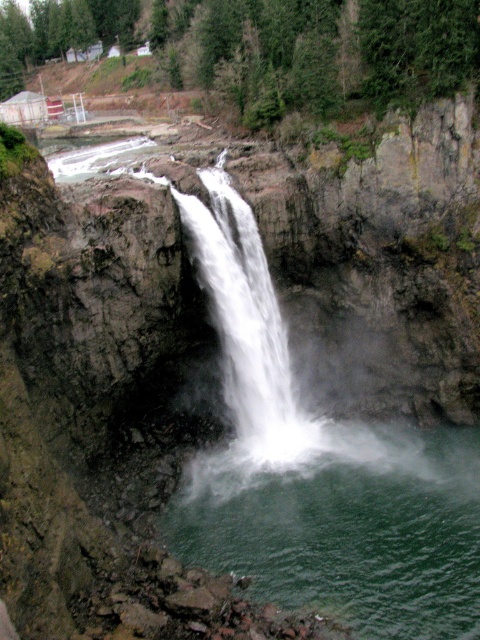
Is point (416, 595) positioned behind point (278, 422)?

That is False.

You are a GUI agent. You are given a task and a screenshot of the screen. Output one action in this format:
    pyautogui.click(x=<x>, y=<y>)
    Task: Click on the green liquid at center
    
    Given the screenshot: What is the action you would take?
    pyautogui.click(x=346, y=525)